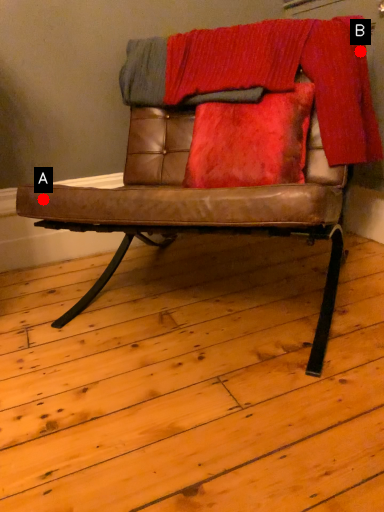
Question: Two points are circled on the image, labeled by A and B beside each circle. Which point is farther to the camera?

Choices:
 (A) A is further
 (B) B is further

Answer: (B)